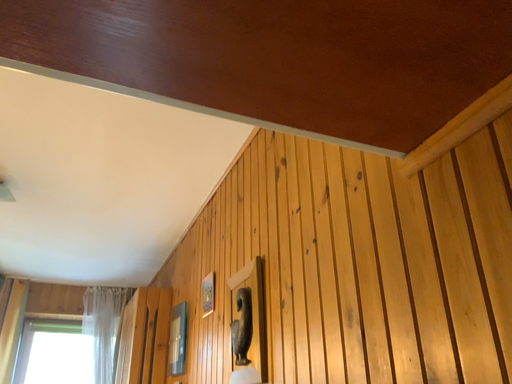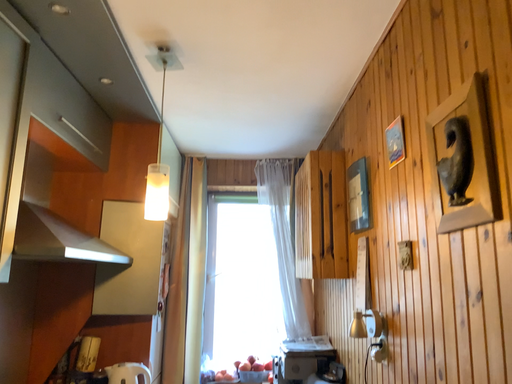
Question: How did the camera likely rotate when shooting the video?

Choices:
 (A) rotated upward
 (B) rotated downward

Answer: (B)